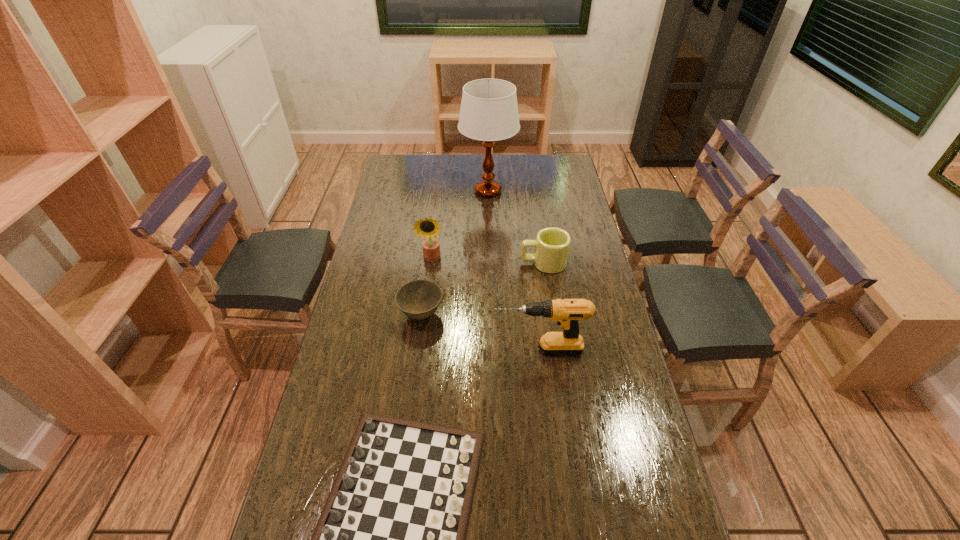
The image size is (960, 540). In order to click on vacant region located at the tip of the drill in this screenshot , I will do `click(405, 350)`.

Find the location of a particular element. The width and height of the screenshot is (960, 540). free space located 0.210m at the tip of the drill is located at coordinates (424, 350).

This screenshot has height=540, width=960. Identify the location of vacant region located 0.270m with the handle on the side of the third shortest object. (447, 263).

This screenshot has width=960, height=540. What are the coordinates of `vacant space located 0.140m with the handle on the side of the third shortest object` in the screenshot? It's located at (482, 263).

The height and width of the screenshot is (540, 960). What are the coordinates of `vacant space located 0.240m with the handle on the side of the third shortest object` in the screenshot? It's located at (455, 263).

Find the location of `free location located on the front of the second shortest object`. free location located on the front of the second shortest object is located at coordinates (408, 416).

Locate an element on the screen. This screenshot has height=540, width=960. object situated at the far edge is located at coordinates (489, 112).

In order to click on drill that is positioned at the right edge in this screenshot , I will do `click(567, 312)`.

At what (x,y) coordinates should I click in order to perform the action: click on mug situated at the right edge. Please return your answer as a coordinate pair (x, y). Looking at the image, I should click on (552, 245).

In the image, there is a desktop. At what (x,y) coordinates should I click in order to perform the action: click on vacant space at the far edge. Please return your answer as a coordinate pair (x, y). Looking at the image, I should click on (501, 175).